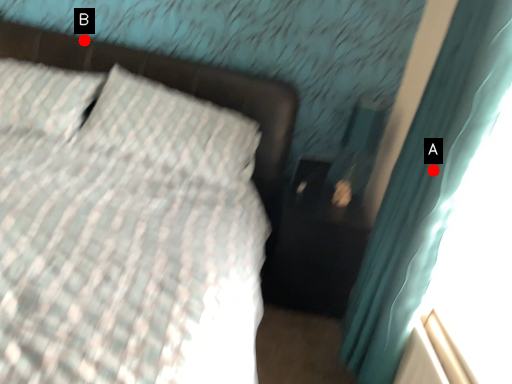
Question: Two points are circled on the image, labeled by A and B beside each circle. Which point is farther to the camera?

Choices:
 (A) A is further
 (B) B is further

Answer: (B)